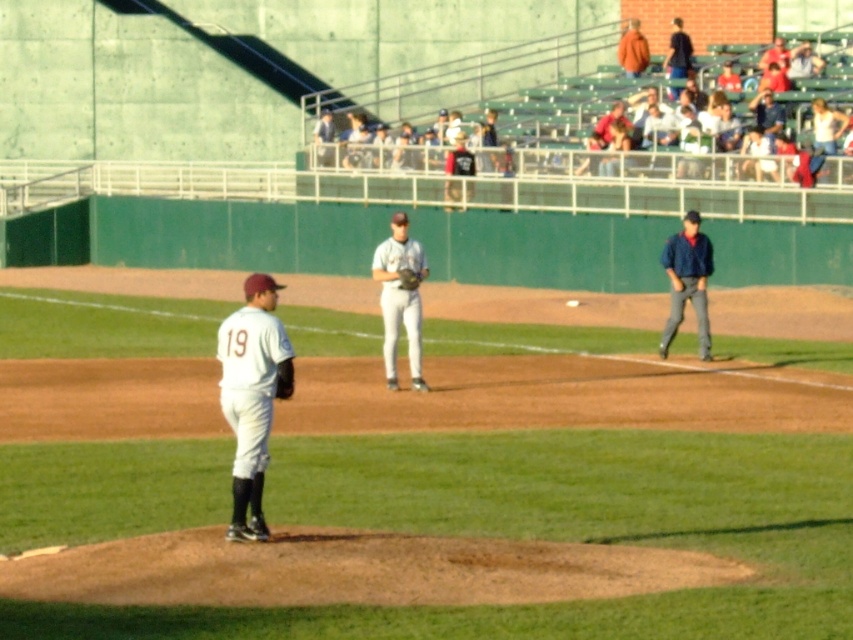
You are a spectator at the baseball game and want to take a photo of the orange jacket at upper right and the white uniformed players at upper center. To ensure both are in the frame, should you adjust your camera to a wider angle or a narrower angle?

The white uniformed players at upper center are to the left of the orange jacket at upper right, so you should use a wider angle to capture both in the frame.

You are a spectator at the baseball game and want to take a photo of both the white uniform at center and the blue denim jacket at right. Which object should you focus on first to ensure both are in the frame?

The white uniform at center is positioned on the left side of blue denim jacket at right, so you should focus on the white uniform at center first to ensure both are in the frame.